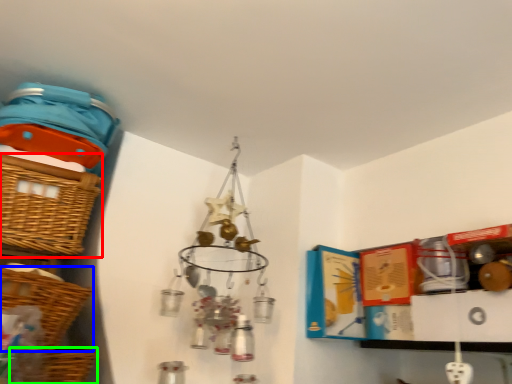
Question: Estimate the real-world distances between objects in this image. Which object is farther from basket (highlighted by a red box), basket (highlighted by a blue box) or basket (highlighted by a green box)?

Choices:
 (A) basket
 (B) basket

Answer: (B)